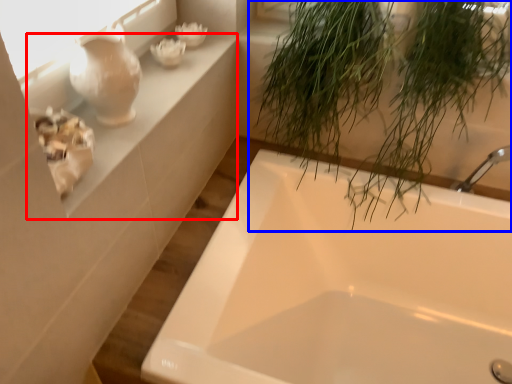
Question: Among these objects, which one is farthest to the camera, window sill (highlighted by a red box) or houseplant (highlighted by a blue box)?

Choices:
 (A) window sill
 (B) houseplant

Answer: (B)